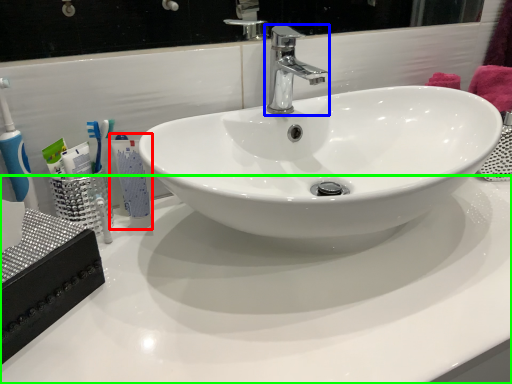
Question: Which is farther away from mouthwash (highlighted by a red box)? tap (highlighted by a blue box) or counter top (highlighted by a green box)?

Choices:
 (A) tap
 (B) counter top

Answer: (A)